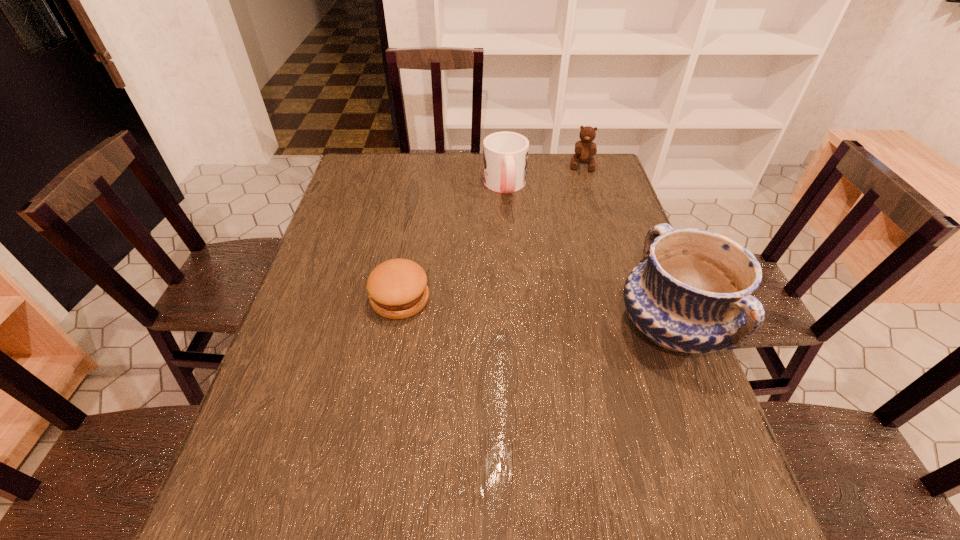
The height and width of the screenshot is (540, 960). Find the location of `the leftmost object`. the leftmost object is located at coordinates (397, 288).

You are a GUI agent. You are given a task and a screenshot of the screen. Output one action in this format:
    pyautogui.click(x=<x>, y=<y>)
    Task: Click on the hamburger
    
    Given the screenshot: What is the action you would take?
    pyautogui.click(x=397, y=288)

Identify the location of pottery. The height and width of the screenshot is (540, 960). (691, 292).

What are the coordinates of `mug` in the screenshot? It's located at (505, 154).

This screenshot has height=540, width=960. What are the coordinates of `teddy bear` in the screenshot? It's located at (585, 149).

Image resolution: width=960 pixels, height=540 pixels. What are the coordinates of `free location located 0.220m on the right of the shortest object` in the screenshot? It's located at (516, 299).

The image size is (960, 540). I want to click on free space located 0.110m on the front of the tallest object, so click(x=711, y=429).

Find the location of `vacant space positioned on the side of the mug with the handle`. vacant space positioned on the side of the mug with the handle is located at coordinates (516, 249).

Find the location of a particular element. blank area located 0.060m on the side of the mug with the handle is located at coordinates (510, 215).

You are a GUI agent. You are given a task and a screenshot of the screen. Output one action in this format:
    pyautogui.click(x=<x>, y=<y>)
    Task: Click on the free region located on the side of the mug with the handle
    
    Given the screenshot: What is the action you would take?
    pyautogui.click(x=521, y=271)